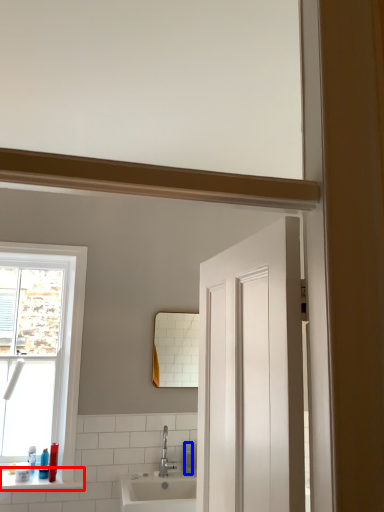
Question: Which of the following is the farthest to the observer, window sill (highlighted by a red box) or soap dispenser (highlighted by a blue box)?

Choices:
 (A) window sill
 (B) soap dispenser

Answer: (B)